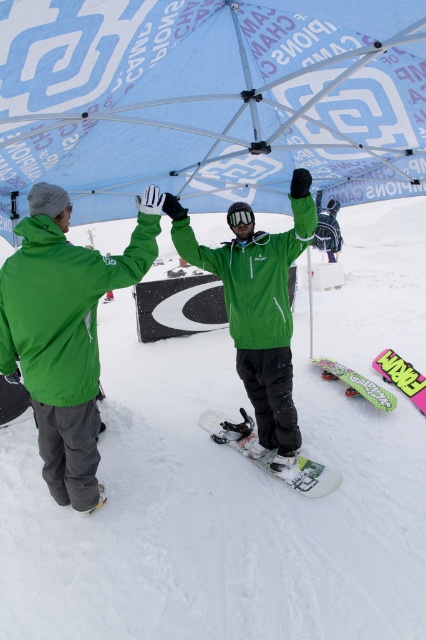
You are a photographer trying to capture a clear shot of the green matte jacket at center and the white matte snowboard at center. Since you want the snowboard to be in focus, which object should you adjust your camera focus on first?

The white matte snowboard at center is in front of the green matte jacket at center, so you should focus on the white matte snowboard at center first to ensure it is in focus.

You are a photographer at the snowboarding event. You want to capture a photo where the white matte snowboard at center is clearly visible without being blocked by the green matte jacket at center. Based on the scene, is this possible?

The white matte snowboard at center is positioned over the green matte jacket at center, so it would block the view of the jacket. To ensure the snowboard is visible without obstruction, the photographer should adjust the angle to avoid the jacket covering it.

You are a photographer at a snowboarding event. You need to capture a photo that includes both the blue printed canopy at upper center and the pink matte snowboard at lower right. Based on their positions, which object should be placed higher in the frame to ensure both are visible?

The blue printed canopy at upper center is located above the pink matte snowboard at lower right, so to include both in the frame, the canopy should be positioned higher up while the snowboard is lower down.